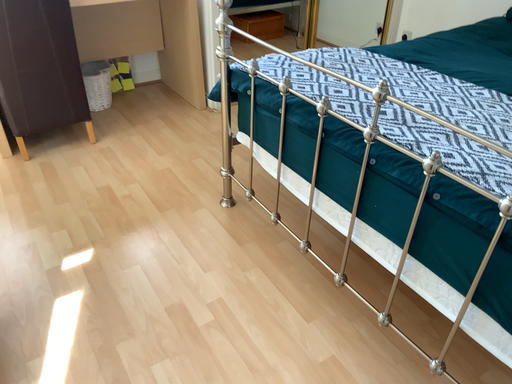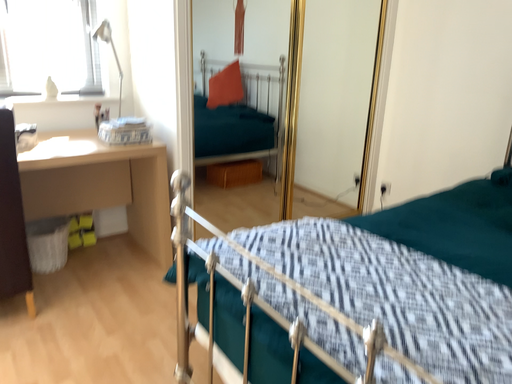
Question: How did the camera likely rotate when shooting the video?

Choices:
 (A) rotated downward
 (B) rotated upward

Answer: (B)